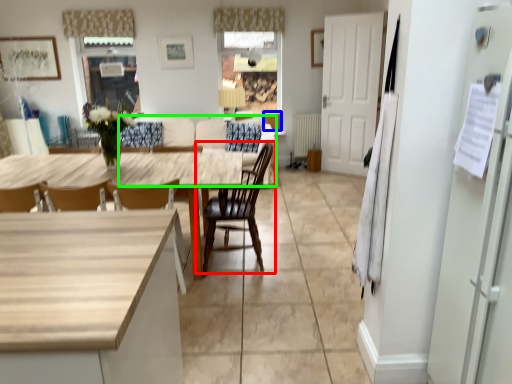
Question: Which is nearer to the chair (highlighted by a red box)? cabinetry (highlighted by a blue box) or couch (highlighted by a green box).

Choices:
 (A) cabinetry
 (B) couch

Answer: (B)